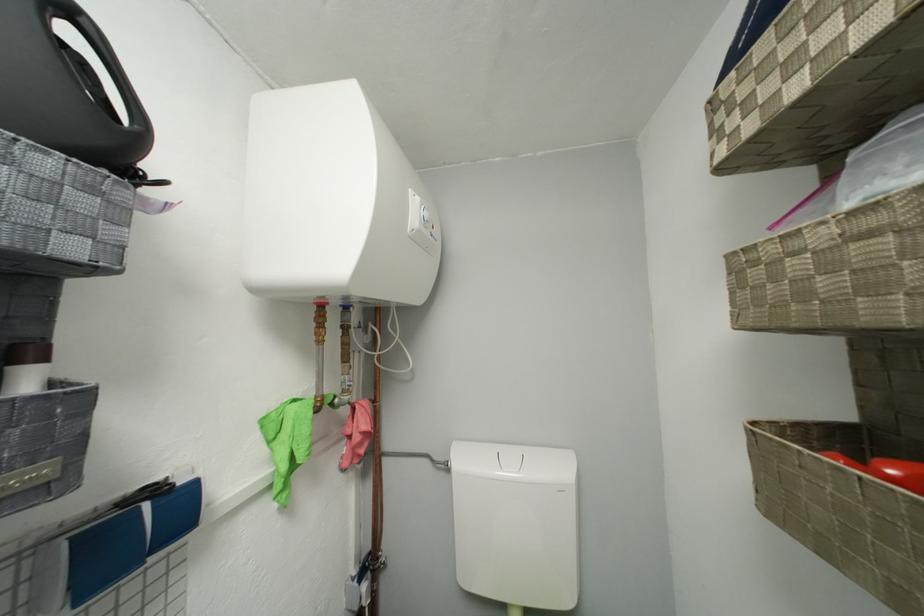
This screenshot has height=616, width=924. Describe the element at coordinates (419, 216) in the screenshot. I see `a water heater dial` at that location.